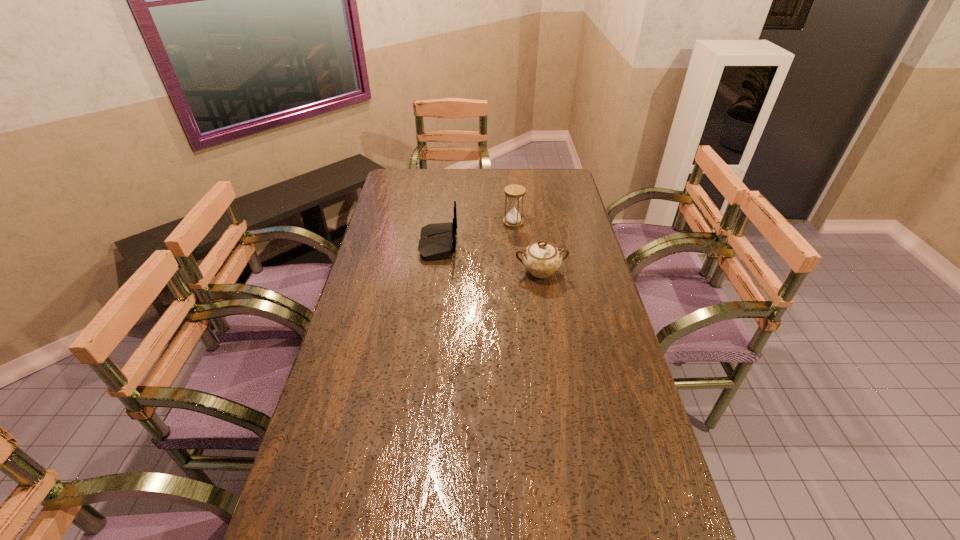
This screenshot has height=540, width=960. I want to click on vacant space that satisfies the following two spatial constraints: 1. on the front side of the chinaware; 2. on the right side of the hourglass, so click(518, 272).

In order to click on vacant space that satisfies the following two spatial constraints: 1. on the front side of the hourglass; 2. on the left side of the chinaware in this screenshot , I will do `click(518, 272)`.

Find the location of `vacant space that satisfies the following two spatial constraints: 1. on the back of the chinaware; 2. on the right side of the leftmost object`. vacant space that satisfies the following two spatial constraints: 1. on the back of the chinaware; 2. on the right side of the leftmost object is located at coordinates (435, 272).

Identify the location of free location that satisfies the following two spatial constraints: 1. on the back of the chinaware; 2. on the left side of the router. The width and height of the screenshot is (960, 540). (435, 272).

This screenshot has width=960, height=540. Identify the location of free space that satisfies the following two spatial constraints: 1. on the back of the router; 2. on the back side of the chinaware. (435, 272).